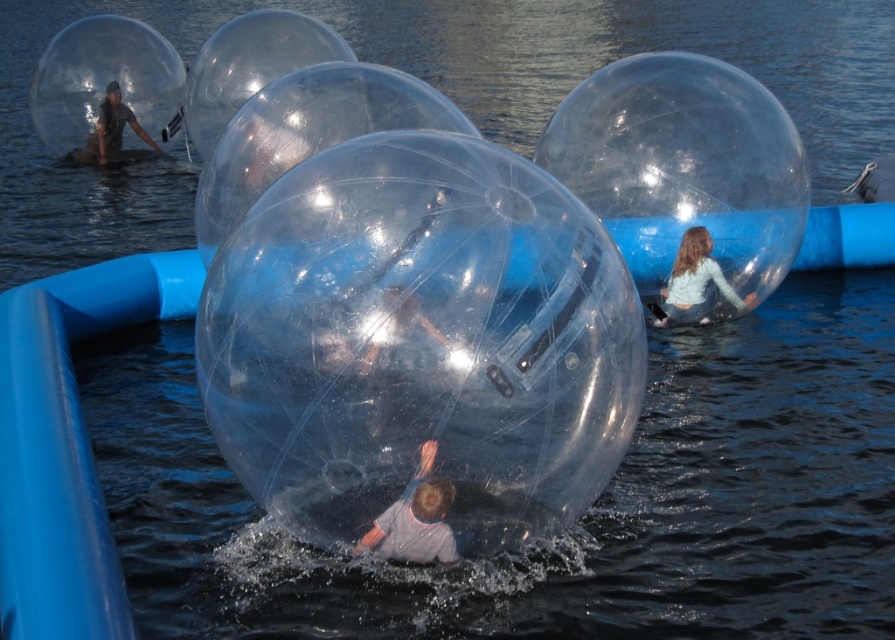
Question: Considering the real-world distances, which object is farthest from the light blue denim jeans at center?

Choices:
 (A) transparent plastic person at upper left
 (B) translucent plastic person at center

Answer: (A)

Question: Is translucent plastic person at center thinner than transparent plastic person at upper left?

Choices:
 (A) yes
 (B) no

Answer: (A)

Question: Which point is closer to the camera taking this photo?

Choices:
 (A) tap(667, 321)
 (B) tap(410, 554)
 (C) tap(122, 116)

Answer: (B)

Question: Is translucent plastic person at center to the right of light blue denim jeans at center from the viewer's perspective?

Choices:
 (A) yes
 (B) no

Answer: (B)

Question: Can you confirm if translucent plastic person at center is positioned to the left of transparent plastic person at upper left?

Choices:
 (A) yes
 (B) no

Answer: (B)

Question: Which of these objects is positioned closest to the transparent plastic person at upper left?

Choices:
 (A) translucent plastic person at center
 (B) light blue denim jeans at center

Answer: (B)